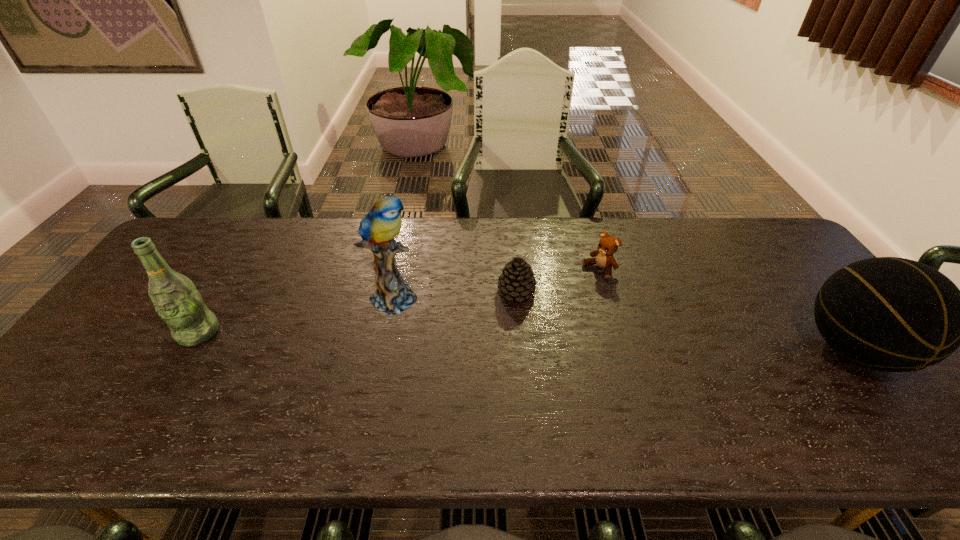
Find the location of a particular element. The width and height of the screenshot is (960, 540). free space between the leftmost object and the pinecone is located at coordinates (357, 312).

Find the location of a particular element. unoccupied position between the basketball and the second object from left to right is located at coordinates (625, 323).

Identify the location of free space that is in between the rightmost object and the tallest object. The height and width of the screenshot is (540, 960). (625, 323).

At what (x,y) coordinates should I click in order to perform the action: click on free space between the rightmost object and the second object from left to right. Please return your answer as a coordinate pair (x, y). Image resolution: width=960 pixels, height=540 pixels. Looking at the image, I should click on (625, 323).

Locate an element on the screen. This screenshot has width=960, height=540. free space between the rightmost object and the fourth object from left to right is located at coordinates (727, 310).

Identify which object is the third nearest to the rightmost object. Please provide its 2D coordinates. Your answer should be formatted as a tuple, i.e. [(x, y)], where the tuple contains the x and y coordinates of a point satisfying the conditions above.

[(378, 229)]

Point out which object is positioned as the nearest to the tallest object. Please provide its 2D coordinates. Your answer should be formatted as a tuple, i.e. [(x, y)], where the tuple contains the x and y coordinates of a point satisfying the conditions above.

[(517, 280)]

At what (x,y) coordinates should I click in order to perform the action: click on free space that satisfies the following two spatial constraints: 1. on the back side of the fourth object from left to right; 2. on the left side of the parrot. Please return your answer as a coordinate pair (x, y). Looking at the image, I should click on (400, 270).